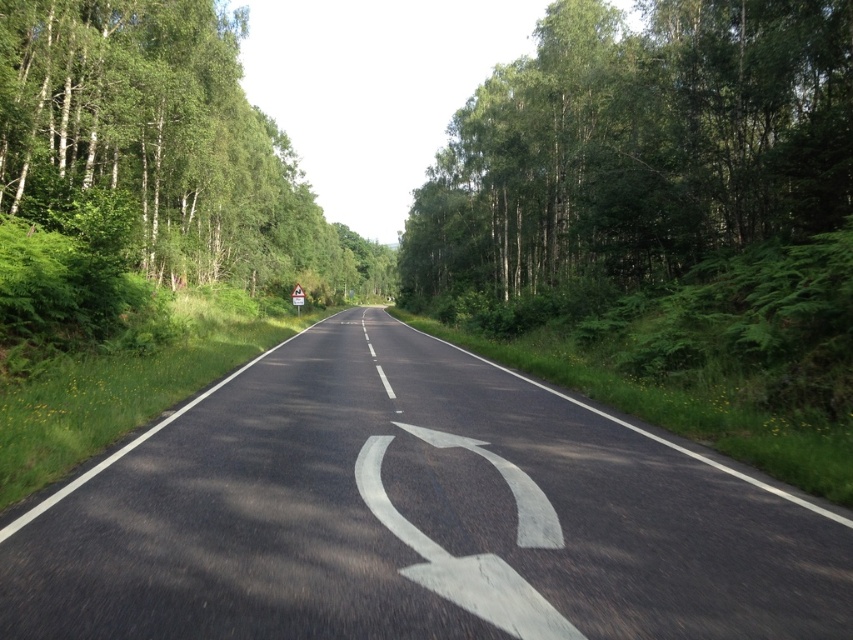
Question: Which object is closer to the camera taking this photo?

Choices:
 (A) green leafy trees at right
 (B) green leafy trees at left

Answer: (A)

Question: Which of the following is the closest to the observer?

Choices:
 (A) black asphalt road at center
 (B) white asphalt curve at center
 (C) green leafy trees at right

Answer: (A)

Question: Is black asphalt road at center wider than green leafy trees at right?

Choices:
 (A) no
 (B) yes

Answer: (A)

Question: Is black asphalt road at center positioned behind green leafy trees at right?

Choices:
 (A) yes
 (B) no

Answer: (B)

Question: Is black asphalt road at center above white asphalt curve at center?

Choices:
 (A) yes
 (B) no

Answer: (A)

Question: Which of these objects is positioned farthest from the black asphalt road at center?

Choices:
 (A) white asphalt curve at center
 (B) green leafy trees at right

Answer: (B)